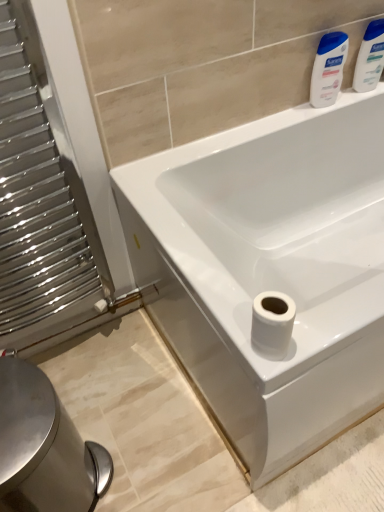
You are a GUI agent. You are given a task and a screenshot of the screen. Output one action in this format:
    pyautogui.click(x=<x>, y=<y>)
    Task: Click on the free spot to the right of white matte toilet paper at lower right
    The image size is (384, 512).
    Given the screenshot: What is the action you would take?
    pyautogui.click(x=329, y=322)